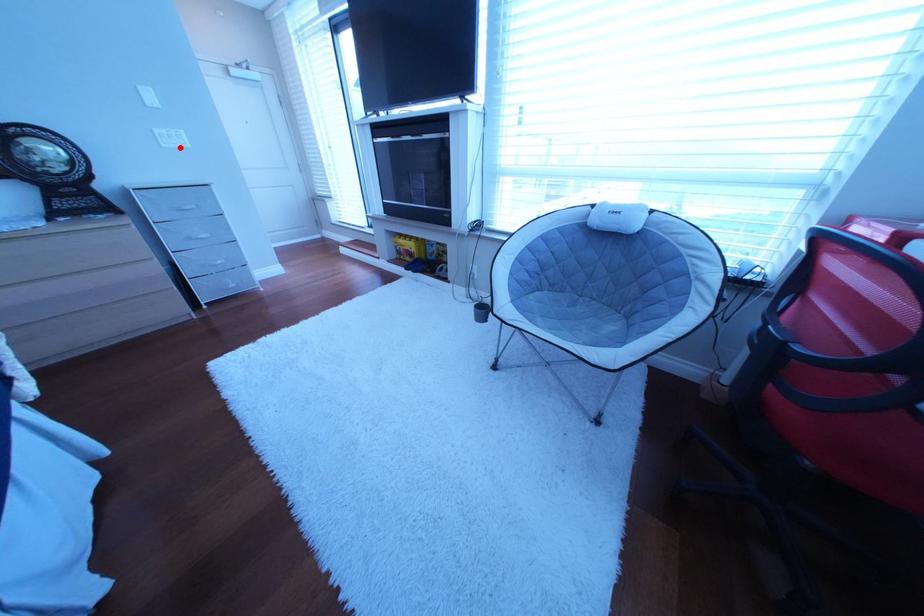
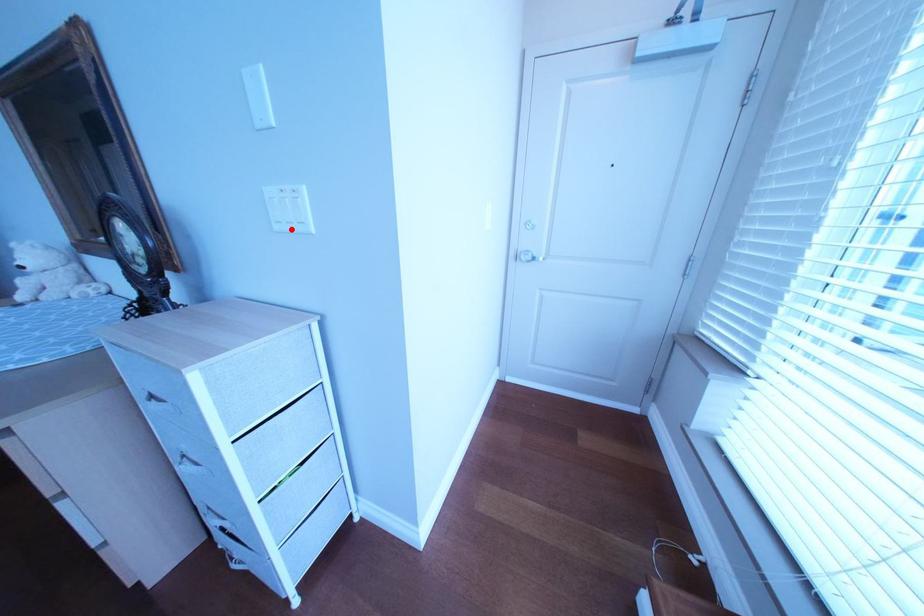
I am providing you with two images of the same scene from different viewpoints. A red point is marked on the first image and another point is marked on the second image. Are the points marked in image1 and image2 representing the same 3D position?

Yes